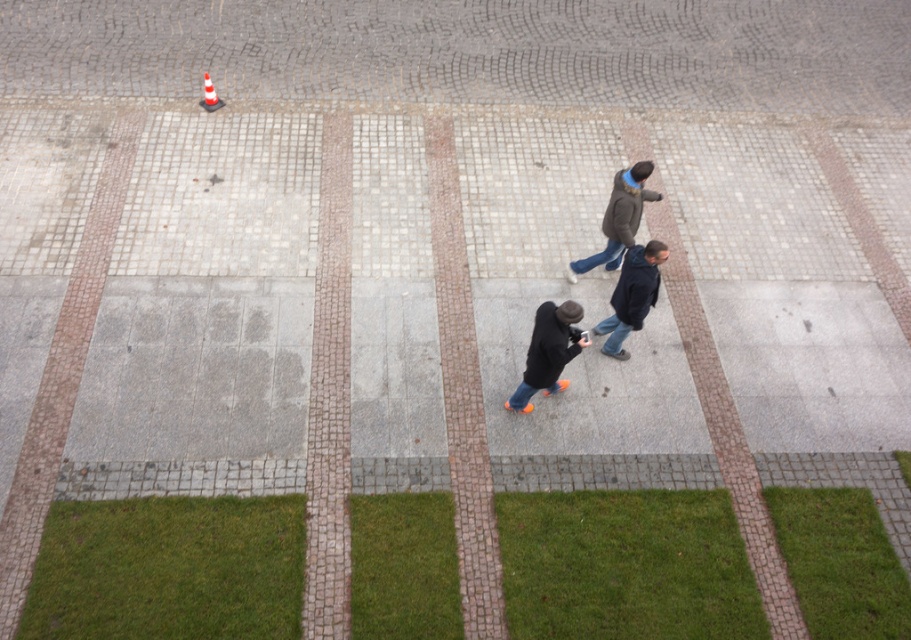
Between orange suede shoes at center and orange and white striped traffic cone at upper left, which one has more height?

orange suede shoes at center is taller.

Is point (559, 307) closer to viewer compared to point (205, 100)?

Yes, point (559, 307) is closer to viewer.

Is point (544, 339) less distant than point (213, 109)?

That is True.

Locate an element on the screen. The height and width of the screenshot is (640, 911). orange suede shoes at center is located at coordinates (548, 352).

Is point (572, 314) less distant than point (657, 248)?

Yes.

Between orange suede shoes at center and dark blue jacket at center, which one has more height?

Standing taller between the two is dark blue jacket at center.

Does point (556, 349) come farther from viewer compared to point (636, 321)?

No, (556, 349) is closer to viewer.

You are a GUI agent. You are given a task and a screenshot of the screen. Output one action in this format:
    pyautogui.click(x=<x>, y=<y>)
    Task: Click on the orange suede shoes at center
    
    Given the screenshot: What is the action you would take?
    pyautogui.click(x=548, y=352)

Can you confirm if dark brown jacket at center is thinner than orange and white striped traffic cone at upper left?

Incorrect, dark brown jacket at center's width is not less than orange and white striped traffic cone at upper left's.

What do you see at coordinates (619, 218) in the screenshot?
I see `dark brown jacket at center` at bounding box center [619, 218].

Where is `dark brown jacket at center`? This screenshot has width=911, height=640. dark brown jacket at center is located at coordinates 619,218.

At what (x,y) coordinates should I click in order to perform the action: click on dark brown jacket at center. Please return your answer as a coordinate pair (x, y). Image resolution: width=911 pixels, height=640 pixels. Looking at the image, I should click on (619, 218).